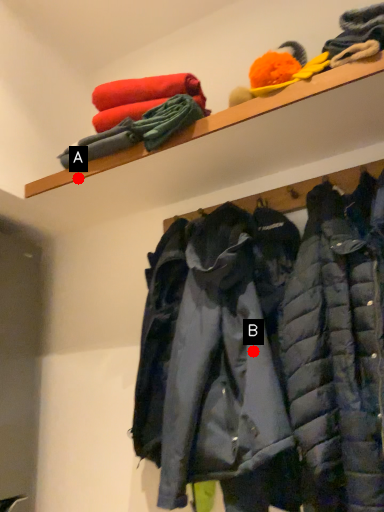
Question: Two points are circled on the image, labeled by A and B beside each circle. Which point is further to the camera?

Choices:
 (A) A is further
 (B) B is further

Answer: (A)